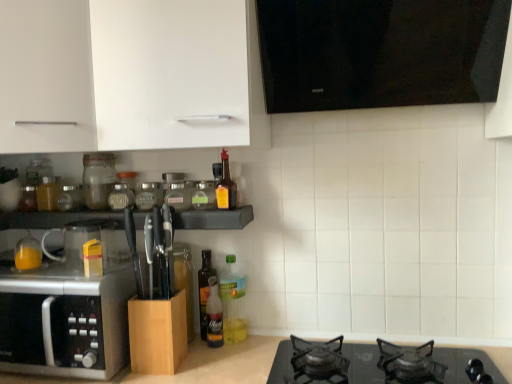
This screenshot has height=384, width=512. What are the coordinates of `free space above black microwave at left (from a real-world perspective)` in the screenshot? It's located at (53, 266).